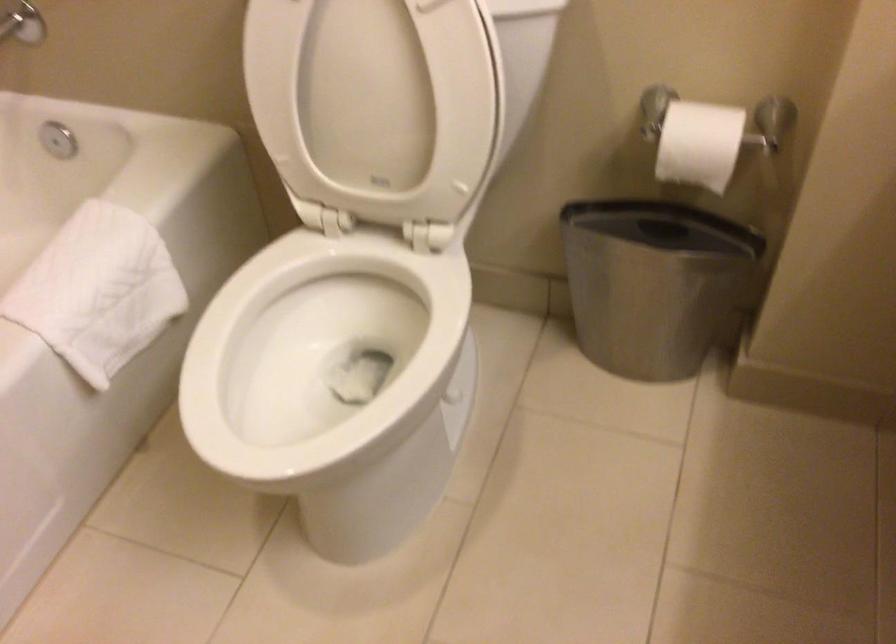
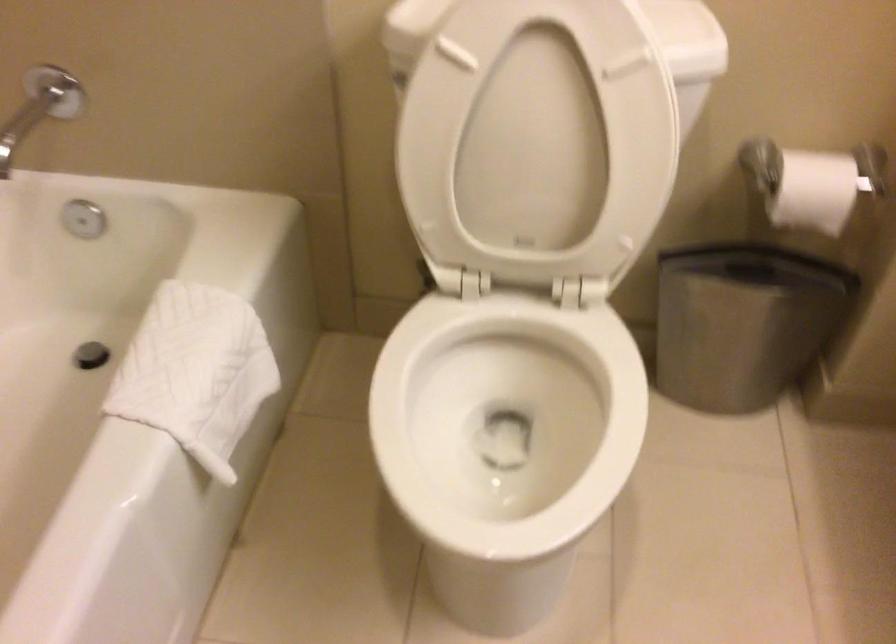
Where in the second image is the point corresponding to point (376, 82) from the first image?

(538, 140)